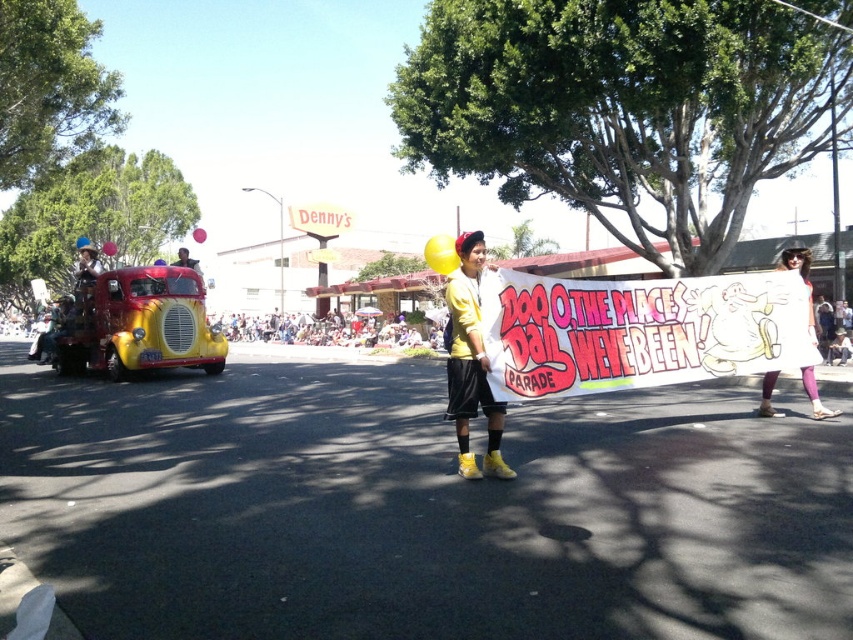
You are a photographer trying to capture the parade scene. You notice two points in the image, one at point coordinates point (473, 381) and another at point (769, 404). Which point should you focus on first if you want to capture the closest subject to the camera?

Point (473, 381) is closer to the camera than point (769, 404), so you should focus on point (473, 381) first to capture the closest subject.

You are a photographer at the Doo Dah Parade. You want to capture a photo where both the yellow matte shirt at center and the white fabric dress at center are clearly visible. Given their height difference, which one might appear larger in the photo?

The yellow matte shirt at center appears larger in the photo because it has a greater height compared to the white fabric dress at center.

You are a photographer at the Doo Dah Parade. You want to capture a photo of both the yellow matte shirt at center and the white fabric dress at center in the same frame. Which direction should you move your camera to include both?

To include both the yellow matte shirt at center and the white fabric dress at center in the same frame, move your camera to the right since the yellow matte shirt at center is to the left of the white fabric dress at center.